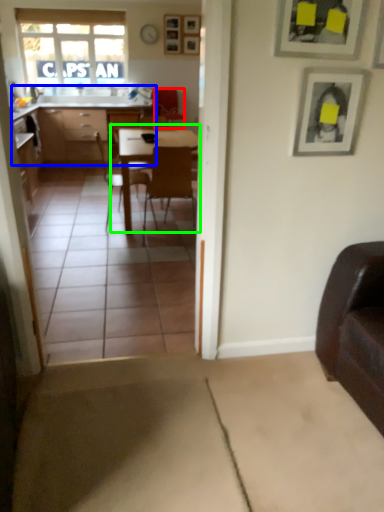
Question: Which object is the closest to the armchair (highlighted by a red box)? Choose among these: cabinetry (highlighted by a blue box) or table (highlighted by a green box).

Choices:
 (A) cabinetry
 (B) table

Answer: (A)